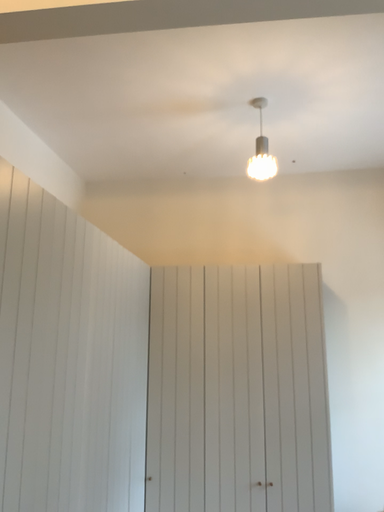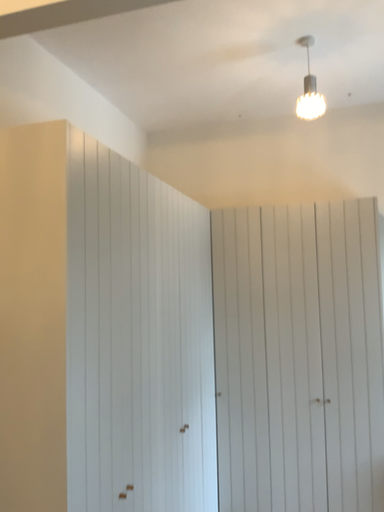
Question: Which way did the camera rotate in the video?

Choices:
 (A) rotated upward
 (B) rotated downward

Answer: (B)